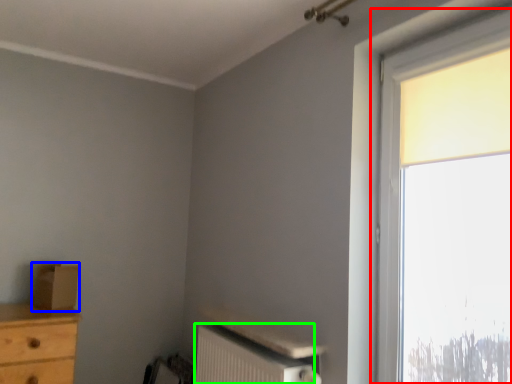
Question: Based on their relative distances, which object is farther from window (highlighted by a red box)? Choose from cardboard box (highlighted by a blue box) and radiator (highlighted by a green box).

Choices:
 (A) cardboard box
 (B) radiator

Answer: (A)